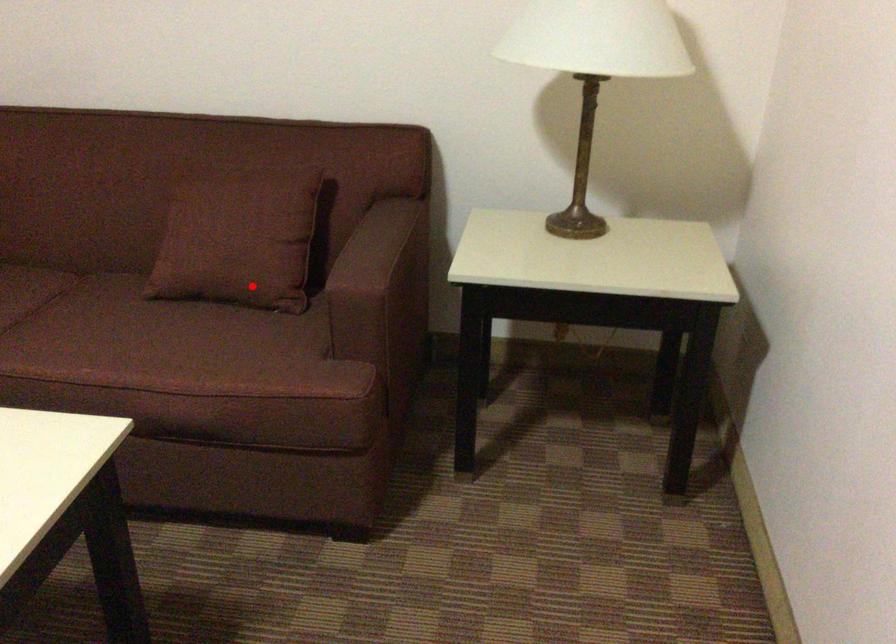
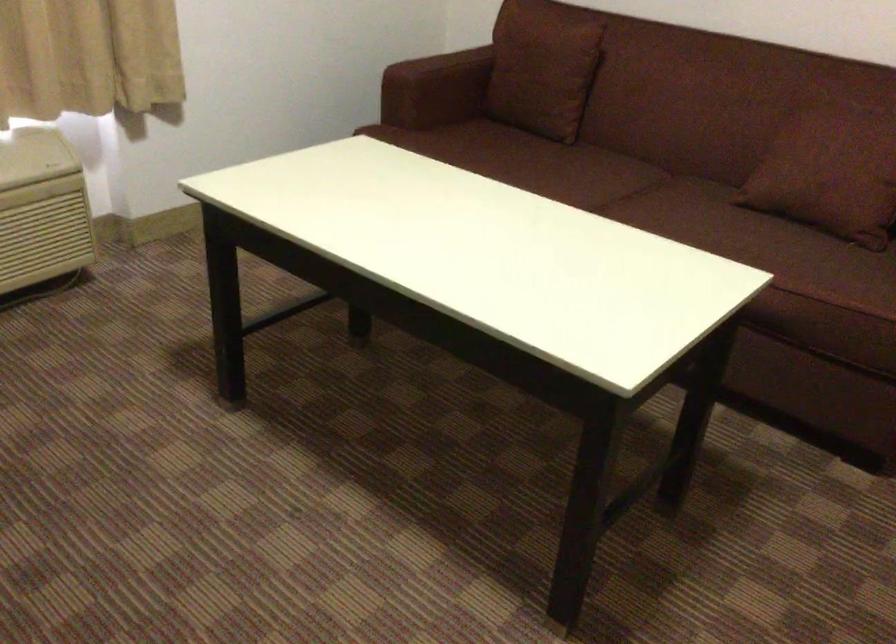
Question: I am providing you with two images of the same scene from different viewpoints. A red point is marked on the first image. Is the red point's position out of view in image 2?

Choices:
 (A) Yes
 (B) No

Answer: (B)